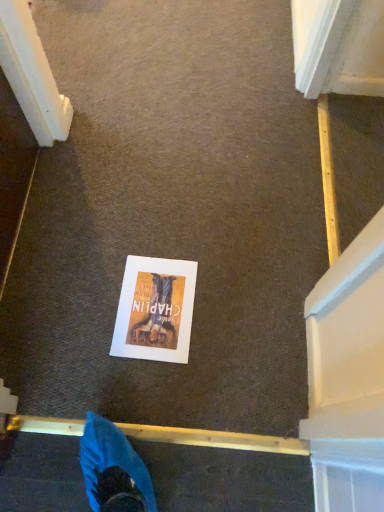
Describe the element at coordinates (155, 310) in the screenshot. I see `white paper at center` at that location.

The height and width of the screenshot is (512, 384). What are the coordinates of `white paper at center` in the screenshot? It's located at (155, 310).

Measure the distance between point (184, 342) and camera.

A distance of 3.81 feet exists between point (184, 342) and camera.

What is the approximate width of white paper at center?

11.90 inches.

What are the coordinates of `white paper at center` in the screenshot? It's located at (155, 310).